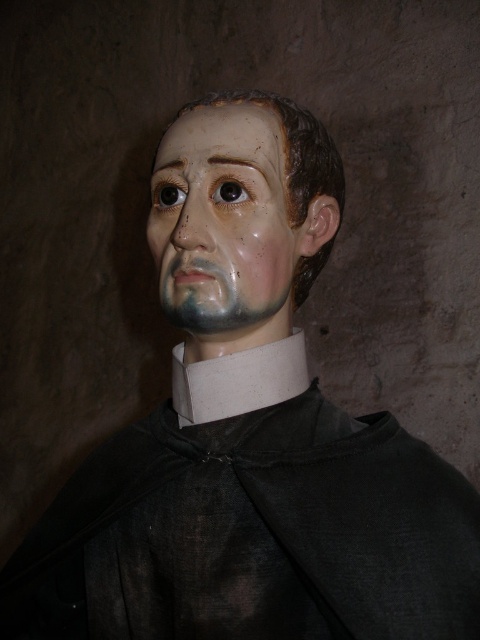
You are an art restorer examining a painting. You notice the black matte robe at center and the matte painted face at center. Which object in the painting takes up more space?

The black matte robe at center has a larger size compared to the matte painted face at center, so the black matte robe at center takes up more space.

From the picture: You are an art conservator examining a painting. You notice two objects in the central area of the painting. One is a black matte robe at center, and the other is a matte plastic nose at center. Based on their positions, which object is positioned to the left?

The matte plastic nose at center is positioned to the left of the black matte robe at center.

You are an art conservator examining a painting. You notice the black matte robe at center and the matte painted face at center. Which object is closer to the viewer?

The black matte robe at center is closer to the viewer than the matte painted face at center.